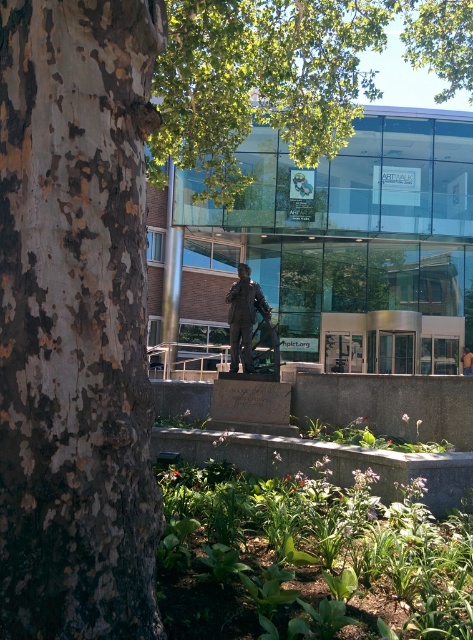
Question: Does bronze statue at center have a larger size compared to yellow t-shirt at center?

Choices:
 (A) yes
 (B) no

Answer: (B)

Question: Which point appears closest to the camera in this image?

Choices:
 (A) (237, 289)
 (B) (465, 348)

Answer: (A)

Question: Among these objects, which one is farthest from the camera?

Choices:
 (A) bronze statue at center
 (B) yellow t-shirt at center

Answer: (B)

Question: Is bronze statue at center closer to camera compared to yellow t-shirt at center?

Choices:
 (A) yes
 (B) no

Answer: (A)

Question: In this image, where is bronze statue at center located relative to yellow t-shirt at center?

Choices:
 (A) left
 (B) right

Answer: (A)